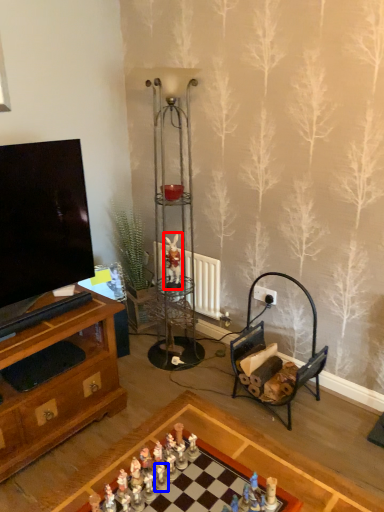
Question: Which point is further to the camera, miniature (highlighted by a red box) or toy (highlighted by a blue box)?

Choices:
 (A) miniature
 (B) toy

Answer: (A)